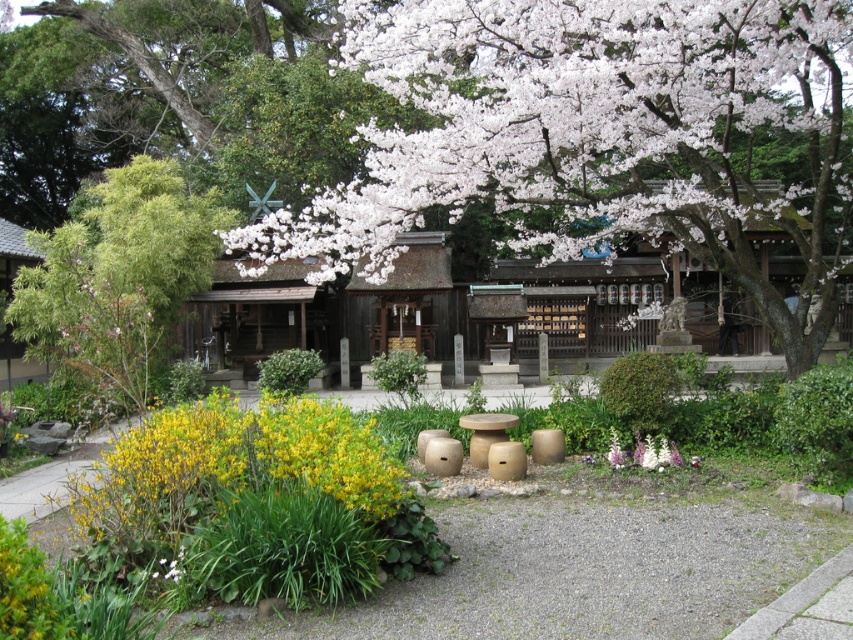
Can you confirm if yellow matte flowers at lower left is positioned to the left of white matte flowers at lower center?

Correct, you'll find yellow matte flowers at lower left to the left of white matte flowers at lower center.

What do you see at coordinates (228, 467) in the screenshot? This screenshot has width=853, height=640. I see `yellow matte flowers at lower left` at bounding box center [228, 467].

Image resolution: width=853 pixels, height=640 pixels. Identify the location of yellow matte flowers at lower left. 228,467.

This screenshot has width=853, height=640. What do you see at coordinates (587, 125) in the screenshot? I see `white petal blossom at center` at bounding box center [587, 125].

Can you confirm if white petal blossom at center is smaller than white matte flower at lower left?

Incorrect, white petal blossom at center is not smaller in size than white matte flower at lower left.

Is point (276, 250) less distant than point (180, 579)?

That is False.

Where is `white petal blossom at center`? This screenshot has height=640, width=853. white petal blossom at center is located at coordinates (587, 125).

Is yellow matte flowers at lower left bigger than white matte flower at lower left?

Indeed, yellow matte flowers at lower left has a larger size compared to white matte flower at lower left.

What do you see at coordinates (228, 467) in the screenshot?
I see `yellow matte flowers at lower left` at bounding box center [228, 467].

This screenshot has height=640, width=853. What do you see at coordinates (228, 467) in the screenshot?
I see `yellow matte flowers at lower left` at bounding box center [228, 467].

The image size is (853, 640). I want to click on yellow matte flowers at lower left, so click(228, 467).